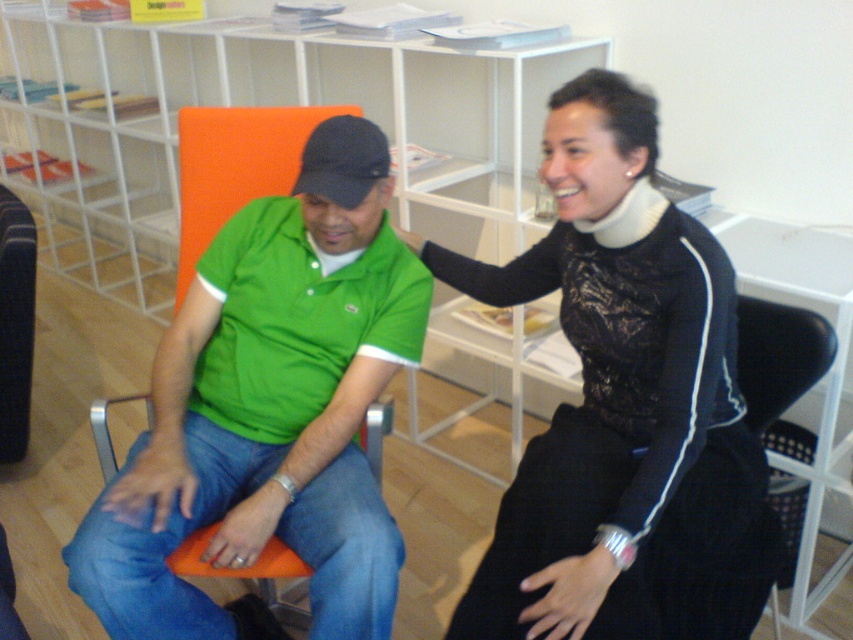
Between black lace top at center and green polo shirt at center, which one is positioned higher?

Positioned higher is black lace top at center.

The height and width of the screenshot is (640, 853). Describe the element at coordinates (624, 412) in the screenshot. I see `black lace top at center` at that location.

Locate an element on the screen. This screenshot has width=853, height=640. black lace top at center is located at coordinates (624, 412).

Who is shorter, black lace top at center or white foam neckband at upper center?

With less height is white foam neckband at upper center.

Is black lace top at center shorter than white foam neckband at upper center?

No.

Identify the location of black lace top at center. The image size is (853, 640). (624, 412).

Between green polo shirt at center and white foam neckband at upper center, which one is positioned higher?

Positioned higher is white foam neckband at upper center.

Which of these two, green polo shirt at center or white foam neckband at upper center, stands taller?

With more height is green polo shirt at center.

What do you see at coordinates (270, 410) in the screenshot? I see `green polo shirt at center` at bounding box center [270, 410].

Where is `green polo shirt at center`? This screenshot has height=640, width=853. green polo shirt at center is located at coordinates (270, 410).